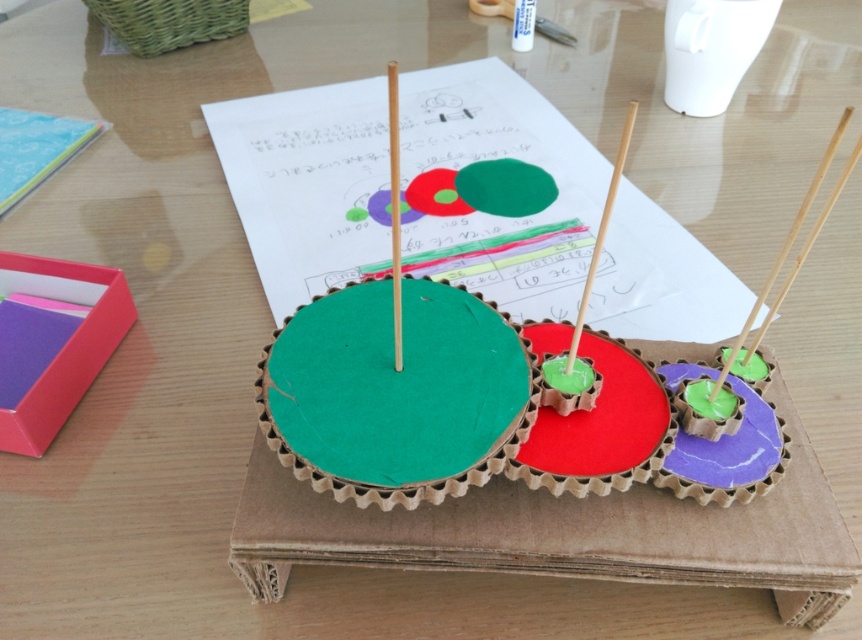
Does wooden stick at center come behind smooth wood toothpick at center?

No, wooden stick at center is closer to the viewer.

Describe the element at coordinates (394, 211) in the screenshot. I see `wooden stick at center` at that location.

At what (x,y) coordinates should I click in order to perform the action: click on wooden stick at center. Please return your answer as a coordinate pair (x, y). This screenshot has width=862, height=640. Looking at the image, I should click on (394, 211).

Is point (417, 323) positioned in front of point (397, 198)?

No.

This screenshot has height=640, width=862. Describe the element at coordinates (395, 392) in the screenshot. I see `green cardboard circle at center` at that location.

Identify the location of green cardboard circle at center. The width and height of the screenshot is (862, 640). (395, 392).

Is green cardboard circle at center below smooth wood toothpick at center?

Yes, green cardboard circle at center is below smooth wood toothpick at center.

Between point (466, 326) and point (603, 244), which one is positioned behind?

Positioned behind is point (466, 326).

Locate an element on the screen. The width and height of the screenshot is (862, 640). green cardboard circle at center is located at coordinates (395, 392).